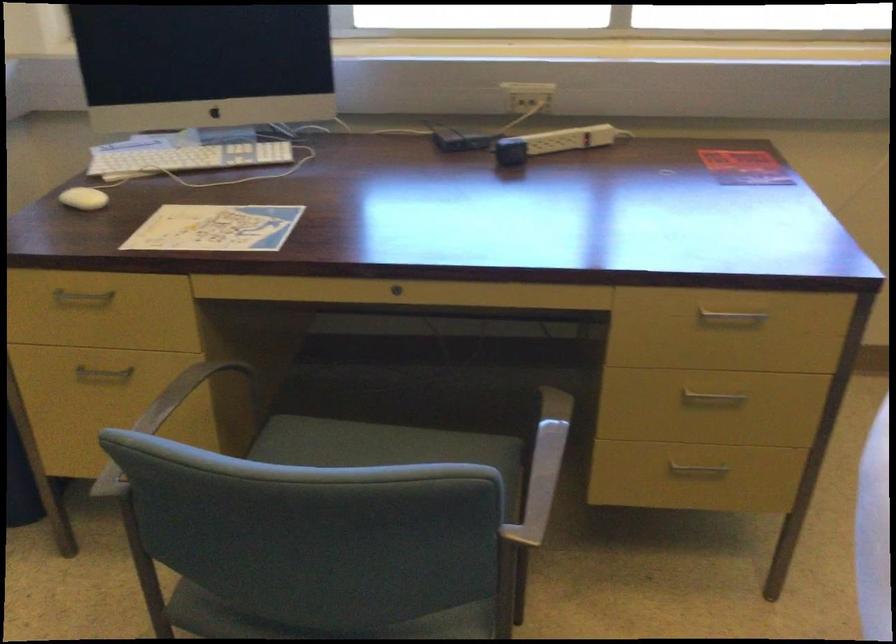
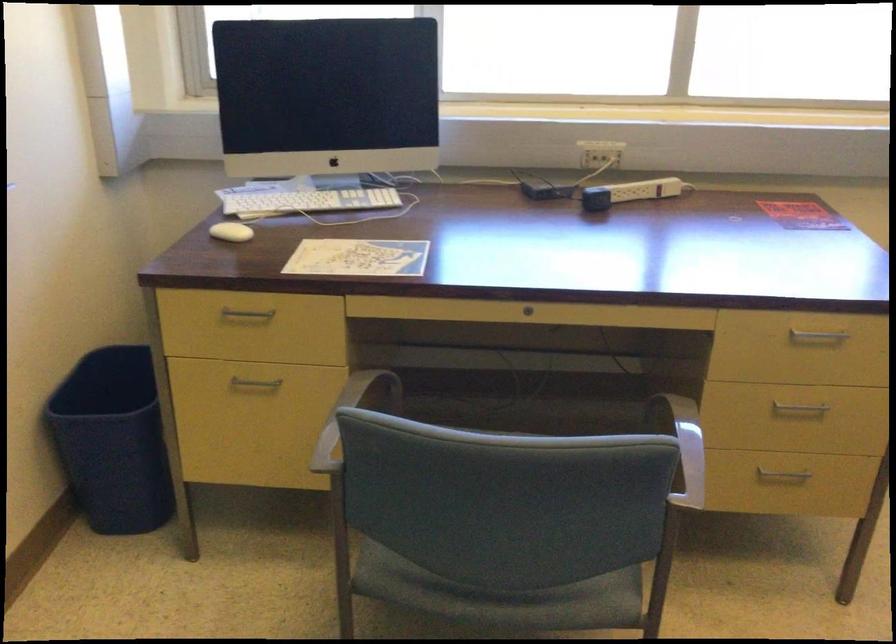
In the second image, find the point that corresponds to the point at 711,399 in the first image.

(798, 408)